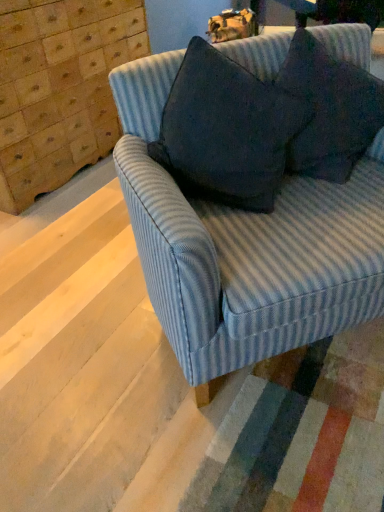
Question: Can you confirm if blue striped fabric couch at center is bigger than dark fabric pillow at upper right, which is counted as the second throw pillow, starting from the left?

Choices:
 (A) no
 (B) yes

Answer: (B)

Question: Can you confirm if blue striped fabric couch at center is wider than dark fabric pillow at upper right, which is counted as the 1th throw pillow, starting from the right?

Choices:
 (A) no
 (B) yes

Answer: (B)

Question: Is blue striped fabric couch at center at the right side of dark fabric pillow at upper right, which is counted as the second throw pillow, starting from the left?

Choices:
 (A) no
 (B) yes

Answer: (A)

Question: From the image's perspective, is blue striped fabric couch at center located beneath dark fabric pillow at upper right, which is counted as the second throw pillow, starting from the left?

Choices:
 (A) yes
 (B) no

Answer: (A)

Question: Would you say blue striped fabric couch at center is a long distance from dark fabric pillow at upper right, which is counted as the 1th throw pillow, starting from the right?

Choices:
 (A) no
 (B) yes

Answer: (A)

Question: Is blue striped fabric couch at center surrounding dark fabric pillow at upper right, which is counted as the 1th throw pillow, starting from the right?

Choices:
 (A) no
 (B) yes

Answer: (B)

Question: Can you confirm if blue striped fabric couch at center is bigger than wooden dresser at upper left?

Choices:
 (A) no
 (B) yes

Answer: (B)

Question: Does blue striped fabric couch at center have a greater height compared to wooden dresser at upper left?

Choices:
 (A) yes
 (B) no

Answer: (B)

Question: Is blue striped fabric couch at center looking in the opposite direction of wooden dresser at upper left?

Choices:
 (A) no
 (B) yes

Answer: (B)

Question: Does blue striped fabric couch at center touch wooden dresser at upper left?

Choices:
 (A) no
 (B) yes

Answer: (A)

Question: Is there a large distance between blue striped fabric couch at center and wooden dresser at upper left?

Choices:
 (A) no
 (B) yes

Answer: (B)

Question: From a real-world perspective, does blue striped fabric couch at center sit lower than wooden dresser at upper left?

Choices:
 (A) yes
 (B) no

Answer: (A)

Question: Is dark fabric pillow at upper right, which is counted as the second throw pillow, starting from the left, smaller than dark gray fabric pillow at upper right, the first throw pillow when ordered from left to right?

Choices:
 (A) yes
 (B) no

Answer: (A)